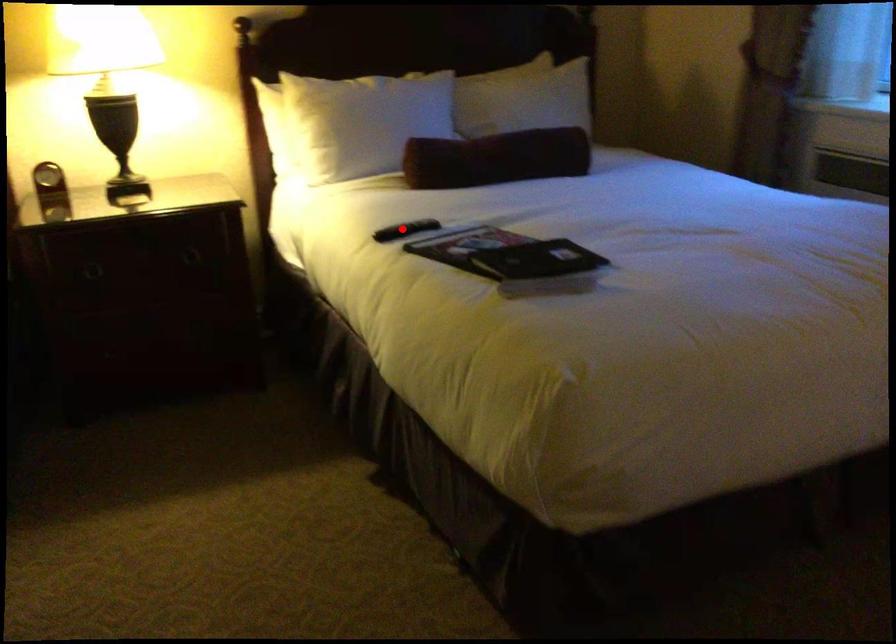
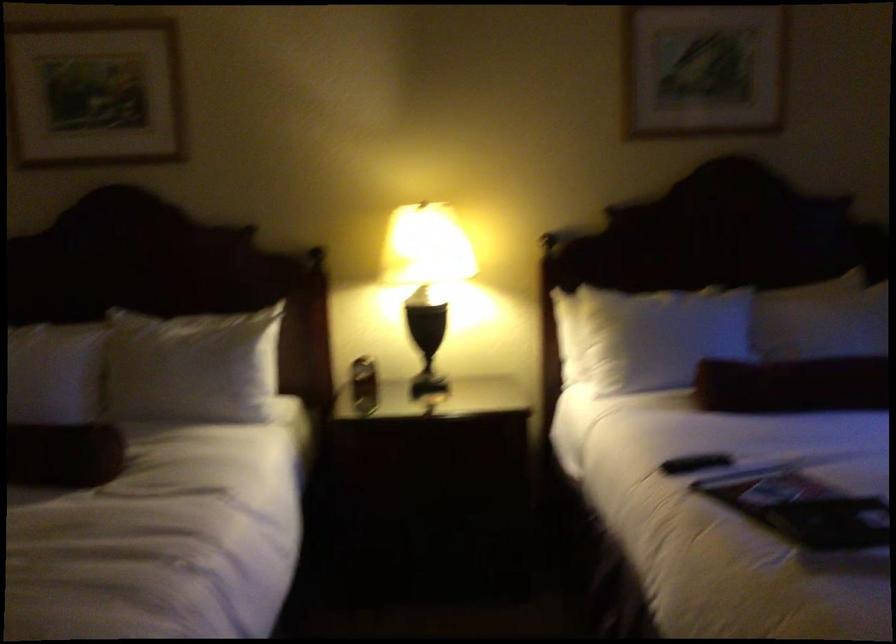
Find the pixel in the second image that matches the highlighted location in the first image.

(695, 462)